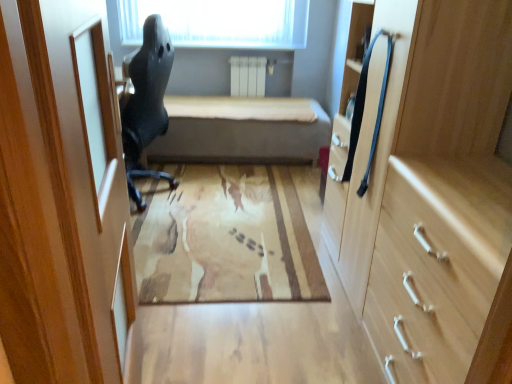
Locate an element on the screen. The height and width of the screenshot is (384, 512). vacant space in front of matte black chair at left is located at coordinates (167, 228).